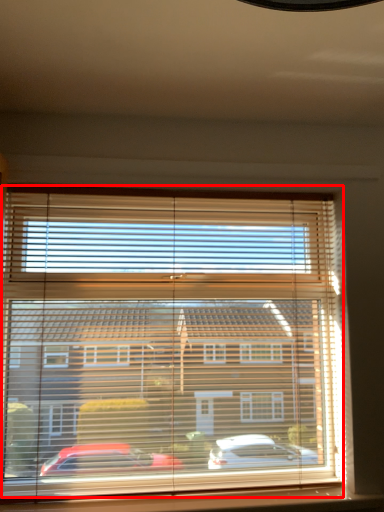
Question: Observing the image, what is the correct spatial positioning of bay window (annotated by the red box) in reference to window sill?

Choices:
 (A) right
 (B) left

Answer: (B)